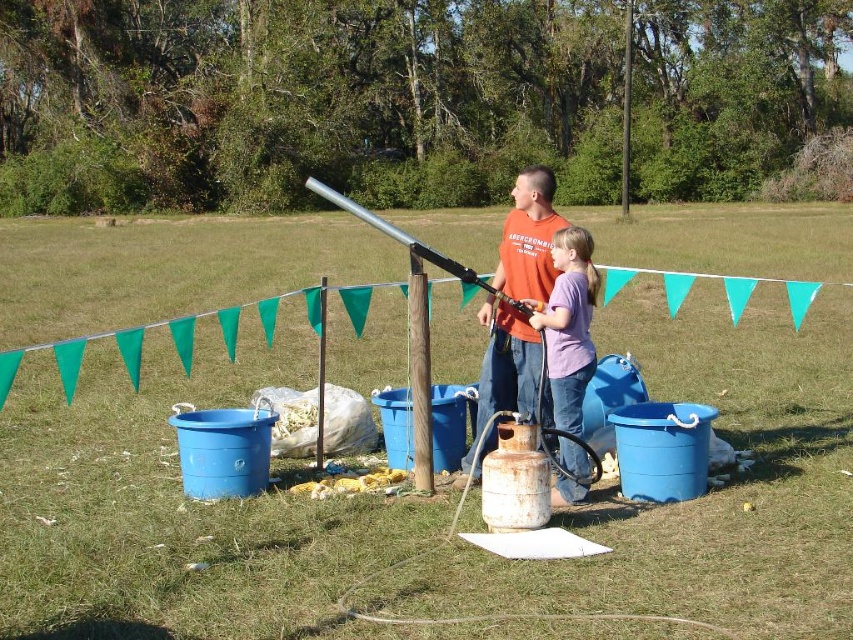
Question: Which of the following is the farthest from the observer?

Choices:
 (A) (567, 364)
 (B) (440, 262)
 (C) (456, 486)

Answer: (C)

Question: Which of the following is the closest to the observer?

Choices:
 (A) silver metallic rifle at center
 (B) purple cotton shirt at center
 (C) orange cotton shirt at center

Answer: (B)

Question: Which of the following is the closest to the observer?

Choices:
 (A) (556, 305)
 (B) (311, 180)

Answer: (A)

Question: Is orange cotton shirt at center further to the viewer compared to purple cotton shirt at center?

Choices:
 (A) no
 (B) yes

Answer: (B)

Question: Can you confirm if purple cotton shirt at center is positioned to the right of silver metallic rifle at center?

Choices:
 (A) no
 (B) yes

Answer: (B)

Question: Is the position of orange cotton shirt at center less distant than that of silver metallic rifle at center?

Choices:
 (A) no
 (B) yes

Answer: (B)